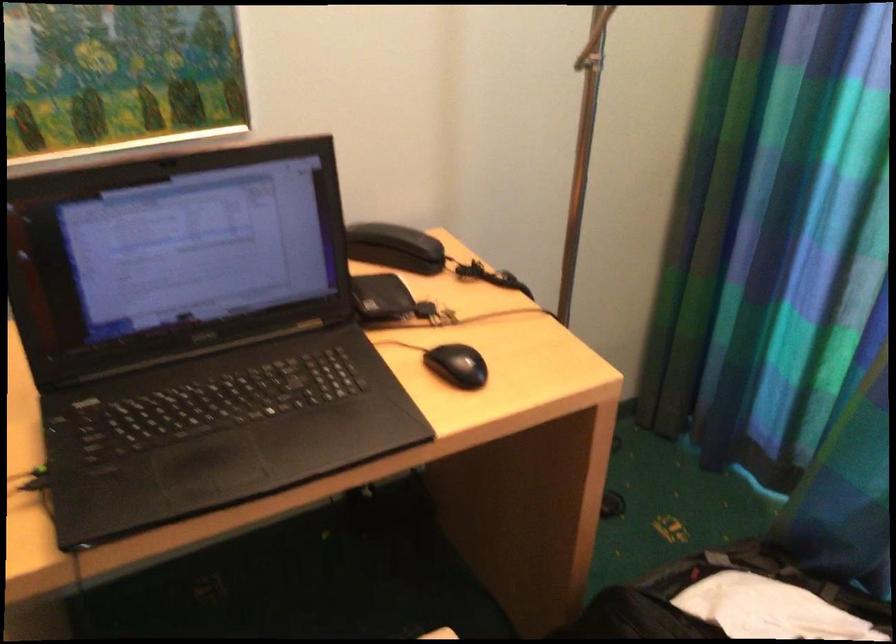
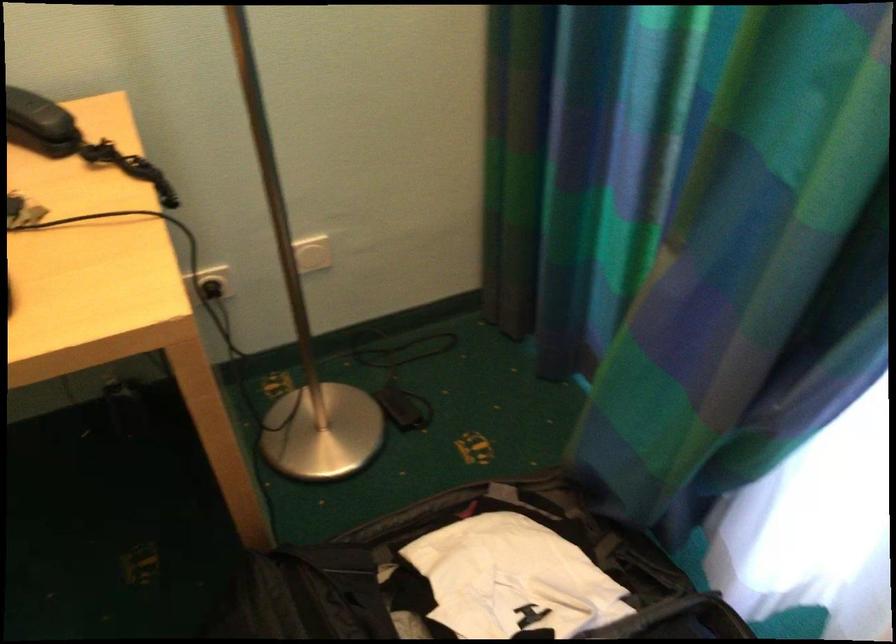
In the second image, find the point that corresponds to [418,243] in the first image.

(40, 122)